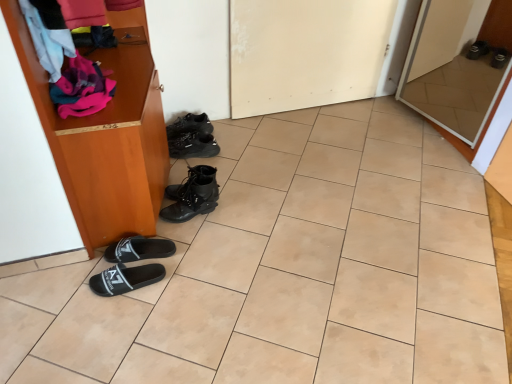
At what (x,y) coordinates should I click in order to perform the action: click on vacant space in between black fabric slipper at lower left, the fifth footwear in the back-to-front sequence, and black fabric slipper at lower left, the 4th footwear from the top. Please return your answer as a coordinate pair (x, y). The width and height of the screenshot is (512, 384). Looking at the image, I should click on (136, 266).